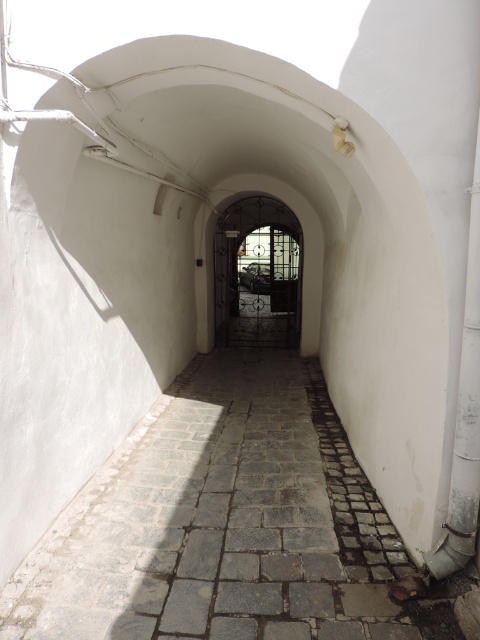
Does gray stone path at center have a lesser width compared to dark wrought iron gate at center?

In fact, gray stone path at center might be wider than dark wrought iron gate at center.

Identify the location of gray stone path at center. (227, 525).

Between point (253, 536) and point (265, 211), which one is positioned in front?

Point (253, 536)

You are a GUI agent. You are given a task and a screenshot of the screen. Output one action in this format:
    pyautogui.click(x=<x>, y=<y>)
    Task: Click on the gray stone path at center
    The width and height of the screenshot is (480, 640).
    Given the screenshot: What is the action you would take?
    pyautogui.click(x=227, y=525)